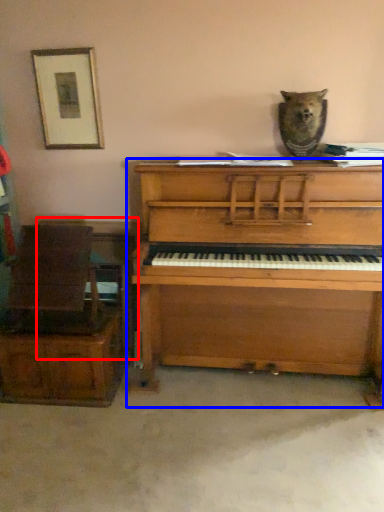
Question: Among these objects, which one is farthest to the camera, table (highlighted by a red box) or piano (highlighted by a blue box)?

Choices:
 (A) table
 (B) piano

Answer: (A)